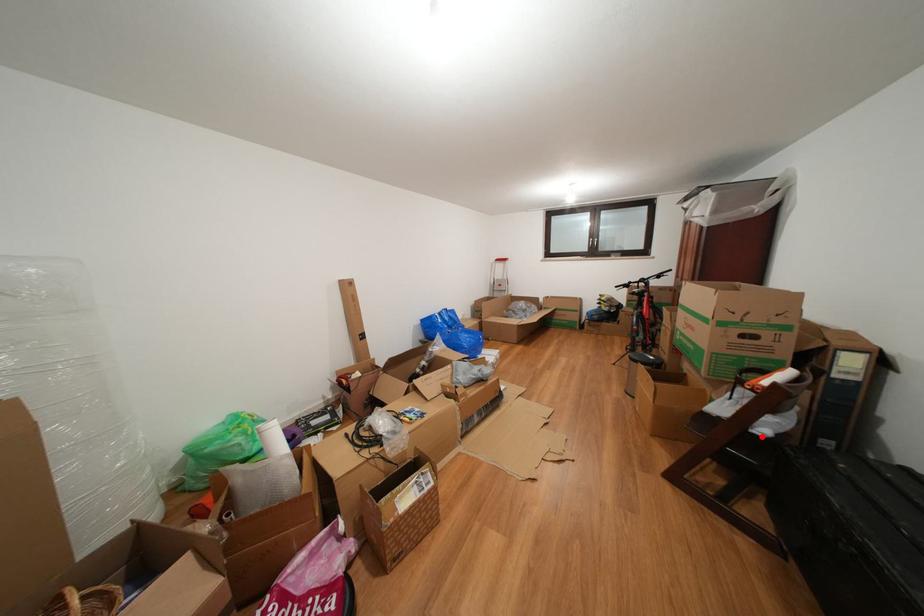
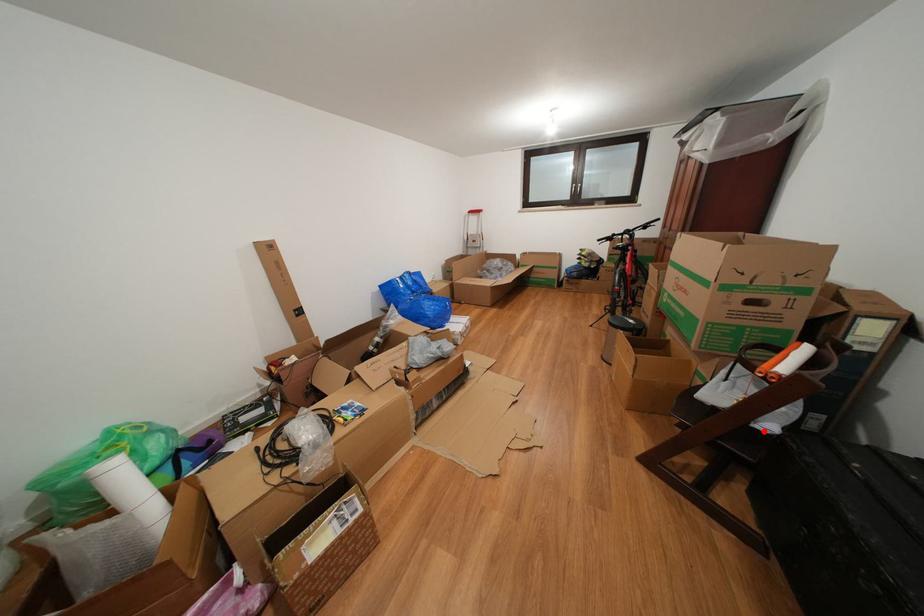
I am providing you with two images of the same scene from different viewpoints. A red point is marked on the first image and another point is marked on the second image. Are the points marked in image1 and image2 representing the same 3D position?

Yes